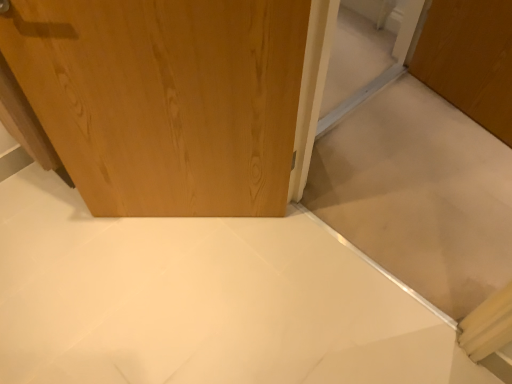
Question: Can you confirm if wooden door at upper left is wider than wooden door at center?

Choices:
 (A) no
 (B) yes

Answer: (A)

Question: Can you see wooden door at upper left touching wooden door at center?

Choices:
 (A) yes
 (B) no

Answer: (B)

Question: Is the depth of wooden door at upper left less than that of wooden door at center?

Choices:
 (A) yes
 (B) no

Answer: (B)

Question: Can you confirm if wooden door at upper left is bigger than wooden door at center?

Choices:
 (A) no
 (B) yes

Answer: (A)

Question: Is wooden door at upper left thinner than wooden door at center?

Choices:
 (A) yes
 (B) no

Answer: (A)

Question: From a real-world perspective, is wooden door at upper left positioned under wooden door at center based on gravity?

Choices:
 (A) no
 (B) yes

Answer: (B)

Question: Is wooden door at center closer to camera compared to wooden door at upper left?

Choices:
 (A) yes
 (B) no

Answer: (A)

Question: Is wooden door at center facing away from wooden door at upper left?

Choices:
 (A) yes
 (B) no

Answer: (B)

Question: Is wooden door at center at the left side of wooden door at upper left?

Choices:
 (A) no
 (B) yes

Answer: (A)

Question: Considering the relative sizes of wooden door at center and wooden door at upper left in the image provided, is wooden door at center wider than wooden door at upper left?

Choices:
 (A) no
 (B) yes

Answer: (B)

Question: Is wooden door at center located outside wooden door at upper left?

Choices:
 (A) no
 (B) yes

Answer: (B)

Question: From a real-world perspective, is wooden door at center positioned over wooden door at upper left based on gravity?

Choices:
 (A) no
 (B) yes

Answer: (B)

Question: From a real-world perspective, is wooden door at center positioned above or below wooden door at upper left?

Choices:
 (A) below
 (B) above

Answer: (B)